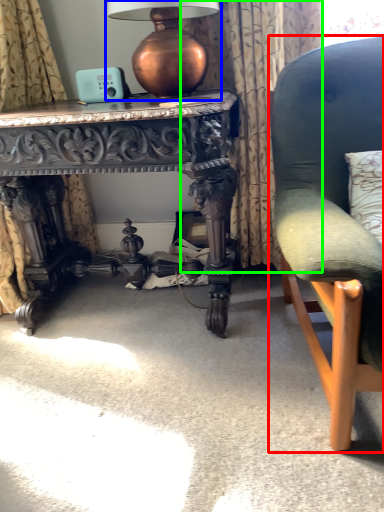
Question: Which is nearer to the chair (highlighted by a red box)? table lamp (highlighted by a blue box) or curtain (highlighted by a green box).

Choices:
 (A) table lamp
 (B) curtain

Answer: (B)